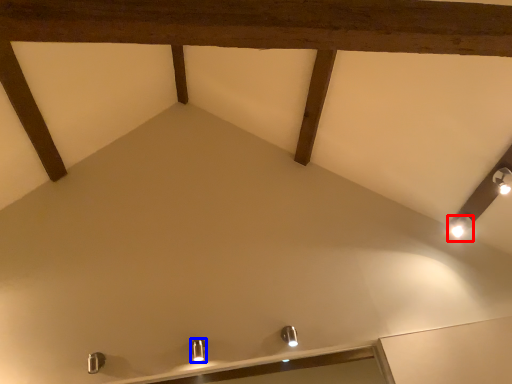
Question: Which object is further to the camera taking this photo, light fixture (highlighted by a red box) or light fixture (highlighted by a blue box)?

Choices:
 (A) light fixture
 (B) light fixture

Answer: (A)